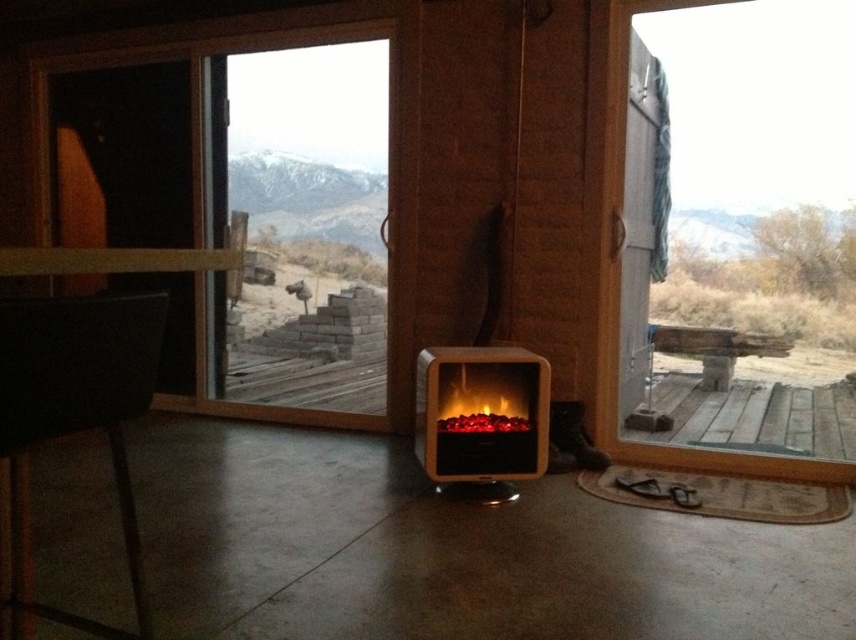
You are standing at the entrance of the cabin and want to step onto the wooden deck at center. Based on its 2D coordinates, in which direction should you move relative to your current position?

The wooden deck at center is located at coordinates (449, 552). Since you are at the entrance, you should move towards the right and slightly forward to reach it.